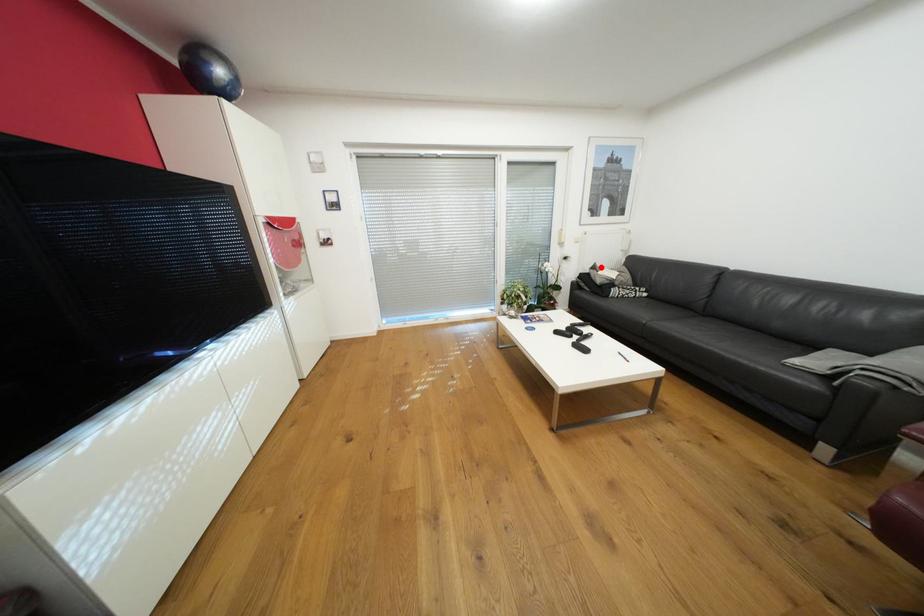
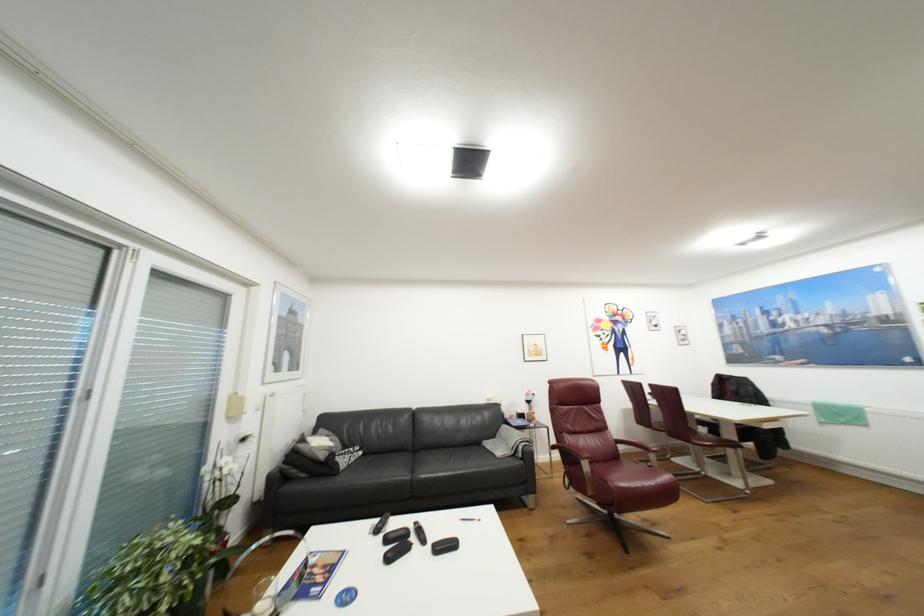
Question: I am providing you with two images of the same scene from different viewpoints. A red point is shown in image1. For the corresponding object point in image2, is it positioned nearer or farther from the camera?

Choices:
 (A) Nearer
 (B) Farther

Answer: (B)